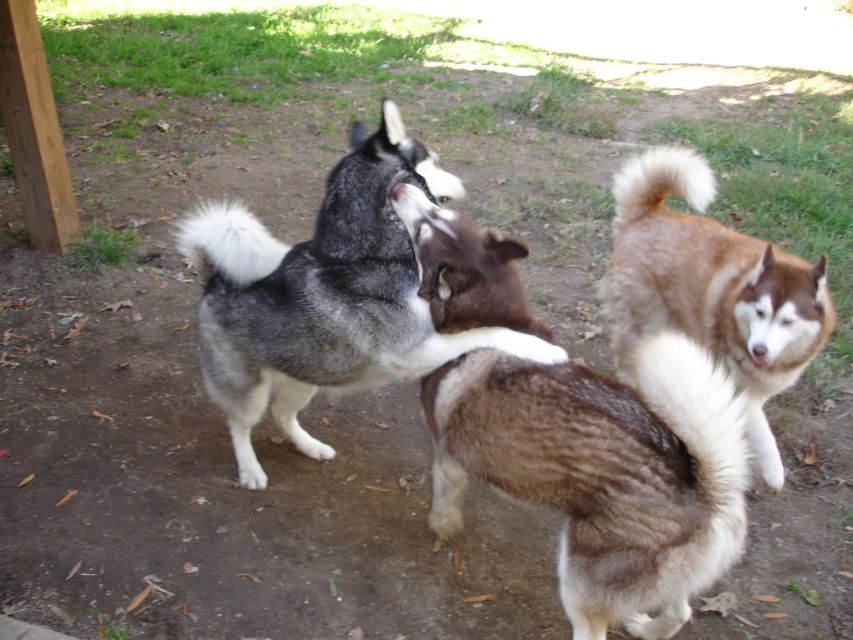
Question: Based on their relative distances, which object is farther from the brown fuzzy dog at right?

Choices:
 (A) gray and white fur husky at center
 (B) brown fur at center

Answer: (A)

Question: Which point is farther from the camera taking this photo?

Choices:
 (A) (699, 300)
 (B) (627, 589)
 (C) (465, 340)

Answer: (A)

Question: Is gray and white fur husky at center wider than brown fuzzy dog at right?

Choices:
 (A) no
 (B) yes

Answer: (B)

Question: Observing the image, what is the correct spatial positioning of brown fur at center in reference to gray and white fur husky at center?

Choices:
 (A) below
 (B) above

Answer: (A)

Question: Is gray and white fur husky at center to the left of brown fuzzy dog at right from the viewer's perspective?

Choices:
 (A) no
 (B) yes

Answer: (B)

Question: Which point is closer to the camera taking this photo?

Choices:
 (A) (645, 285)
 (B) (514, 348)
 (C) (701, 422)

Answer: (C)